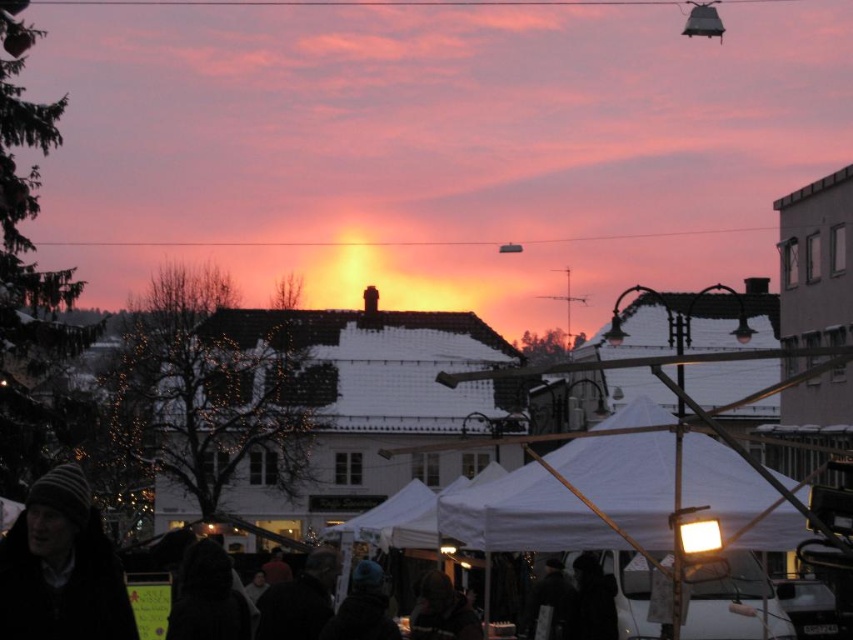
You are standing in the winter market scene and want to pick up the striped knit hat at lower left and the dark blue knit hat at center. Which hat should you reach for first to grab them in order from closest to farthest?

The striped knit hat at lower left is closer to the viewer than the dark blue knit hat at center, so you should reach for the striped knit hat at lower left first.

You are a photographer trying to capture a clear shot of the dark fabric coat at center. However, the white fabric canopy at center is blocking your view. Based on the scene description, can you adjust your position to avoid the obstruction?

The white fabric canopy at center is in front of the dark fabric coat at center, so moving your camera position behind the canopy would allow you to see the dark fabric coat at center without obstruction.